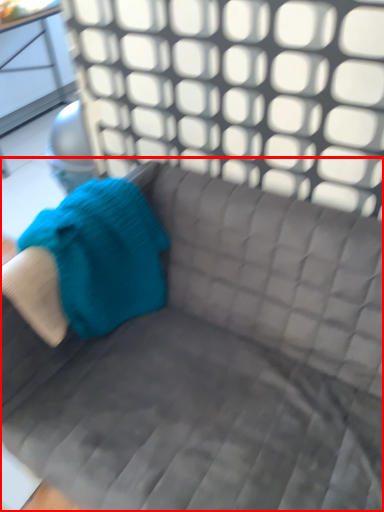
Question: In this image, where is studio couch (annotated by the red box) located relative to bean bag chair?

Choices:
 (A) left
 (B) right

Answer: (B)